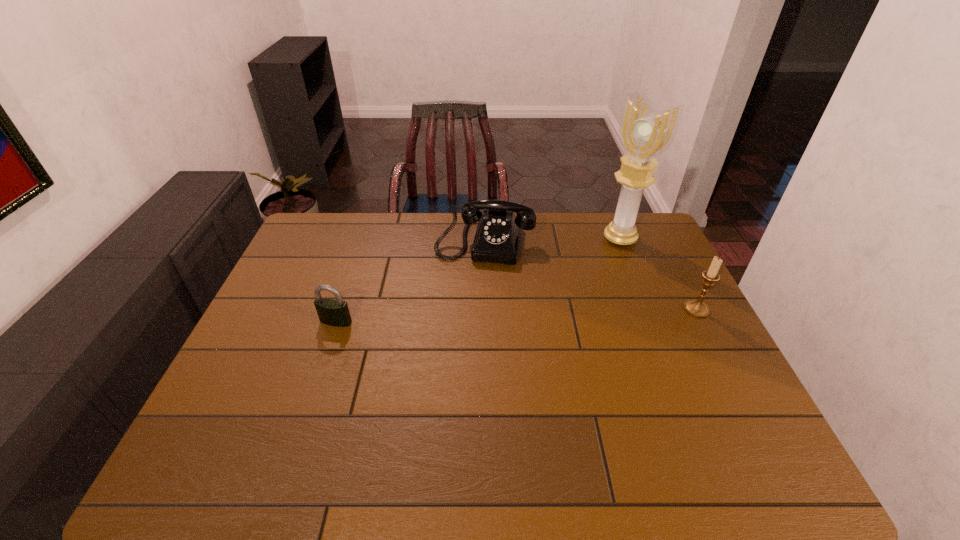
Find the location of a particular element. free location that satisfies the following two spatial constraints: 1. on the back side of the second object from right to left; 2. on the left side of the shortest object is located at coordinates (364, 239).

Locate an element on the screen. The image size is (960, 540). vacant area that satisfies the following two spatial constraints: 1. on the back side of the rightmost object; 2. on the right side of the padlock is located at coordinates (340, 309).